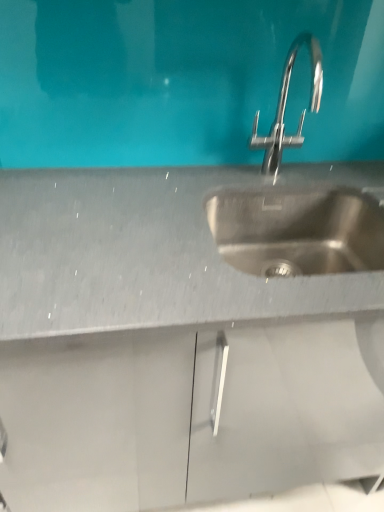
Question: Considering the relative sizes of stainless steel sink at center, the 2th sink viewed from the top, and satin nickel faucet at upper center, the 1th sink viewed from the top, in the image provided, is stainless steel sink at center, the 2th sink viewed from the top, thinner than satin nickel faucet at upper center, the 1th sink viewed from the top,?

Choices:
 (A) no
 (B) yes

Answer: (A)

Question: From the image's perspective, is stainless steel sink at center, the 2th sink viewed from the top, beneath satin nickel faucet at upper center, which ranks as the 2th sink in bottom-to-top order?

Choices:
 (A) no
 (B) yes

Answer: (B)

Question: Can you confirm if stainless steel sink at center, the 2th sink viewed from the top, is positioned to the right of satin nickel faucet at upper center, which ranks as the 2th sink in bottom-to-top order?

Choices:
 (A) no
 (B) yes

Answer: (B)

Question: Does stainless steel sink at center, the 2th sink viewed from the top, lie behind satin nickel faucet at upper center, which ranks as the 2th sink in bottom-to-top order?

Choices:
 (A) no
 (B) yes

Answer: (B)

Question: From a real-world perspective, is stainless steel sink at center, the 2th sink viewed from the top, under satin nickel faucet at upper center, the 1th sink viewed from the top?

Choices:
 (A) no
 (B) yes

Answer: (B)

Question: Can you confirm if stainless steel sink at center, arranged as the first sink when ordered from the bottom, is smaller than satin nickel faucet at upper center, the 1th sink viewed from the top?

Choices:
 (A) yes
 (B) no

Answer: (B)

Question: Could you tell me if satin nickel faucet at upper center, the 1th sink viewed from the top, is facing stainless steel sink at center, arranged as the first sink when ordered from the bottom?

Choices:
 (A) yes
 (B) no

Answer: (B)

Question: From the image's perspective, is satin nickel faucet at upper center, which ranks as the 2th sink in bottom-to-top order, over stainless steel sink at center, arranged as the first sink when ordered from the bottom?

Choices:
 (A) no
 (B) yes

Answer: (B)

Question: From a real-world perspective, is satin nickel faucet at upper center, which ranks as the 2th sink in bottom-to-top order, physically below stainless steel sink at center, arranged as the first sink when ordered from the bottom?

Choices:
 (A) yes
 (B) no

Answer: (B)

Question: Can you confirm if satin nickel faucet at upper center, which ranks as the 2th sink in bottom-to-top order, is taller than stainless steel sink at center, arranged as the first sink when ordered from the bottom?

Choices:
 (A) yes
 (B) no

Answer: (A)

Question: Does satin nickel faucet at upper center, which ranks as the 2th sink in bottom-to-top order, have a greater width compared to stainless steel sink at center, the 2th sink viewed from the top?

Choices:
 (A) no
 (B) yes

Answer: (A)

Question: Does satin nickel faucet at upper center, which ranks as the 2th sink in bottom-to-top order, lie behind stainless steel sink at center, the 2th sink viewed from the top?

Choices:
 (A) no
 (B) yes

Answer: (A)

Question: From the image's perspective, is satin nickel faucet at upper center, the 1th sink viewed from the top, positioned above or below stainless steel sink at center, arranged as the first sink when ordered from the bottom?

Choices:
 (A) above
 (B) below

Answer: (A)